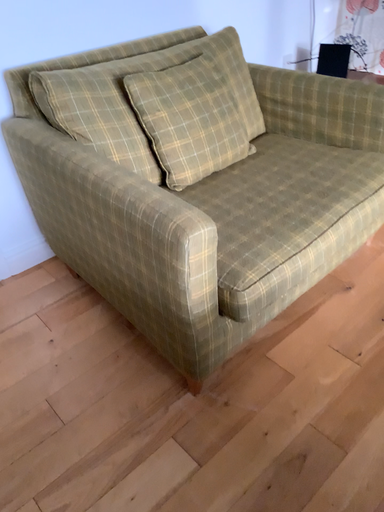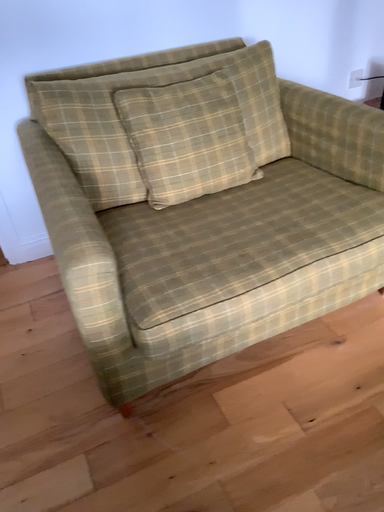
Question: How did the camera likely rotate when shooting the video?

Choices:
 (A) rotated right
 (B) rotated left

Answer: (B)